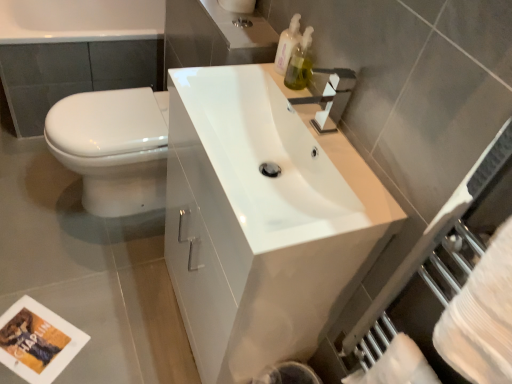
At what (x,y) coordinates should I click in order to perform the action: click on blank space to the left of white glossy sink at center. Please return your answer as a coordinate pair (x, y). Looking at the image, I should click on (102, 288).